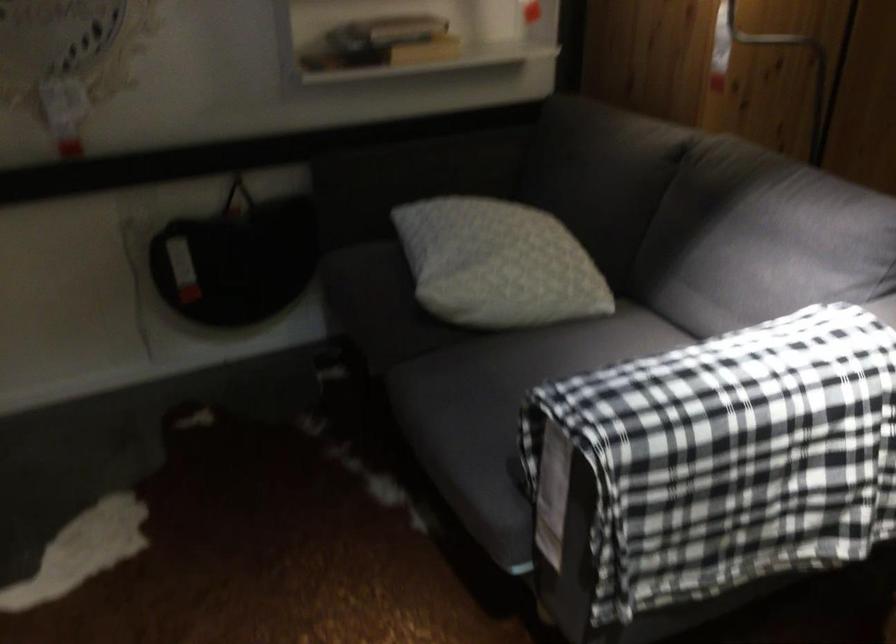
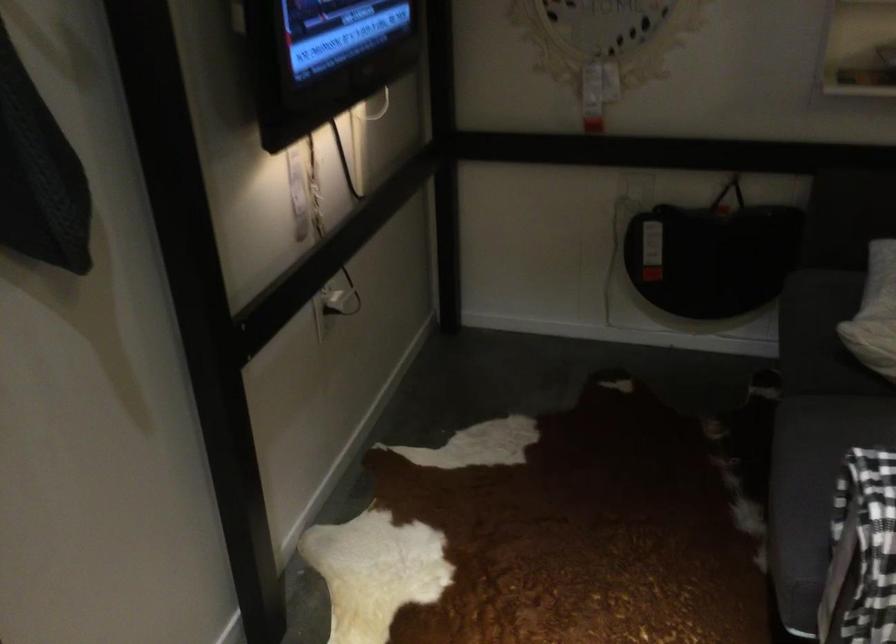
Where in the second image is the point corresponding to [462,451] from the first image?

(805, 494)